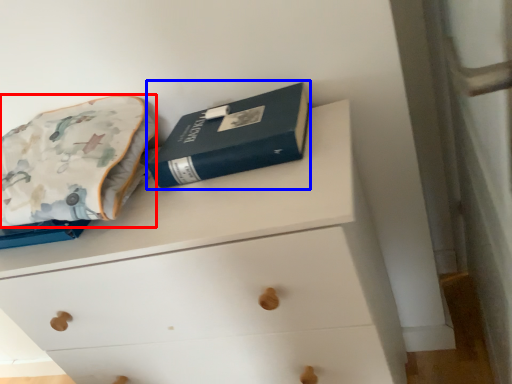
Question: Which object appears farthest to the camera in this image, throw pillow (highlighted by a red box) or paperback book (highlighted by a blue box)?

Choices:
 (A) throw pillow
 (B) paperback book

Answer: (B)